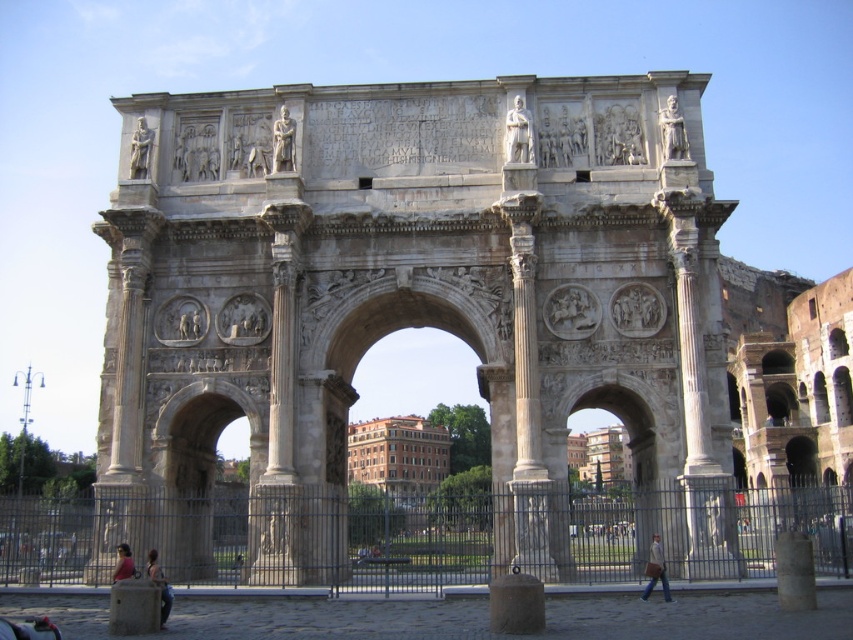
Question: Can you confirm if white marble statue at upper center is smaller than polished marble statue at upper left?

Choices:
 (A) no
 (B) yes

Answer: (A)

Question: Which of these objects is positioned closest to the polished marble statue at upper left?

Choices:
 (A) dark blue jeans at lower center
 (B) light brown leather jacket at lower center
 (C) light brown leather jacket at lower right

Answer: (B)

Question: Is the position of white marble statue at upper right more distant than that of stone statue at center?

Choices:
 (A) no
 (B) yes

Answer: (A)

Question: Among these objects, which one is farthest from the camera?

Choices:
 (A) stone archway at center
 (B) stone statue at center

Answer: (B)

Question: Is polished marble statue at upper left above light brown leather jacket at lower right?

Choices:
 (A) yes
 (B) no

Answer: (A)

Question: Which of the following is the farthest from the observer?

Choices:
 (A) (645, 596)
 (B) (132, 170)
 (C) (148, 216)

Answer: (B)